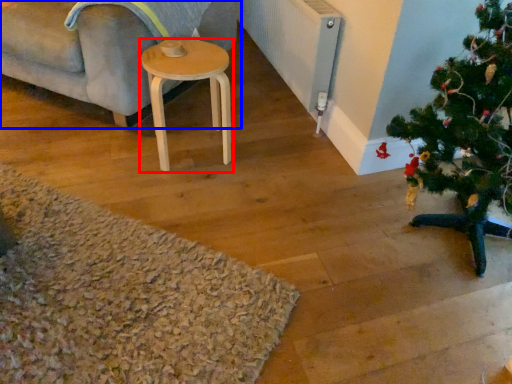
Question: Which object is further to the camera taking this photo, stool (highlighted by a red box) or studio couch (highlighted by a blue box)?

Choices:
 (A) stool
 (B) studio couch

Answer: (A)